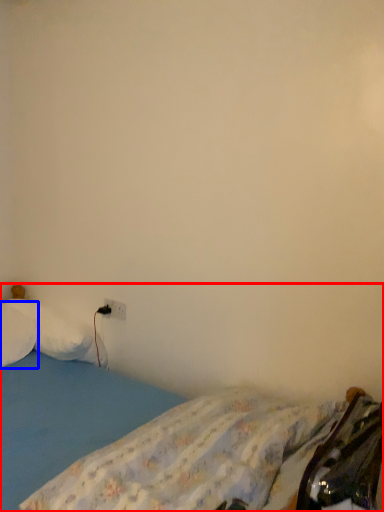
Question: Which point is further to the camera, bed (highlighted by a red box) or pillow (highlighted by a blue box)?

Choices:
 (A) bed
 (B) pillow

Answer: (B)